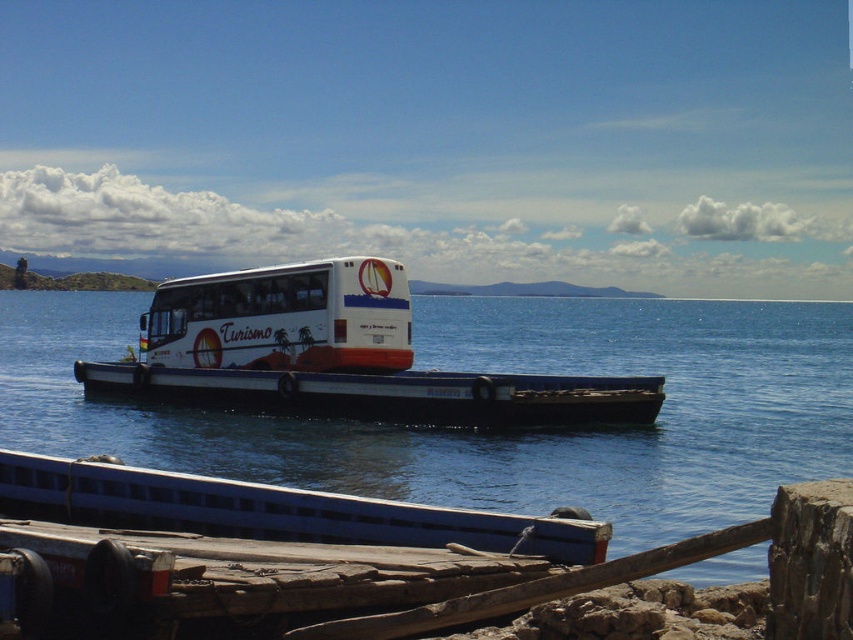
Image resolution: width=853 pixels, height=640 pixels. In order to click on blue water at center in this screenshot , I will do coord(488,429).

Who is more forward, (697, 467) or (178, 515)?

Point (178, 515) is in front.

You are a GUI agent. You are given a task and a screenshot of the screen. Output one action in this format:
    pyautogui.click(x=<x>, y=<y>)
    Task: Click on the blue water at center
    The height and width of the screenshot is (640, 853).
    Given the screenshot: What is the action you would take?
    pyautogui.click(x=488, y=429)

Is point (714, 362) farther from camera compared to point (144, 321)?

Yes, it is.

Between point (692, 461) and point (189, 352), which one is positioned in front?

Point (692, 461)

Locate an element on the screen. The height and width of the screenshot is (640, 853). blue water at center is located at coordinates (488, 429).

Locate an element on the screen. white matte boat at center is located at coordinates (386, 394).

How far apart are white matte boat at center and white glossy bus at center?

They are 4.65 meters apart.

This screenshot has height=640, width=853. In order to click on white matte boat at center in this screenshot , I will do `click(386, 394)`.

At what (x,y) coordinates should I click in order to perform the action: click on white matte boat at center. Please return your answer as a coordinate pair (x, y). This screenshot has height=640, width=853. Looking at the image, I should click on (386, 394).